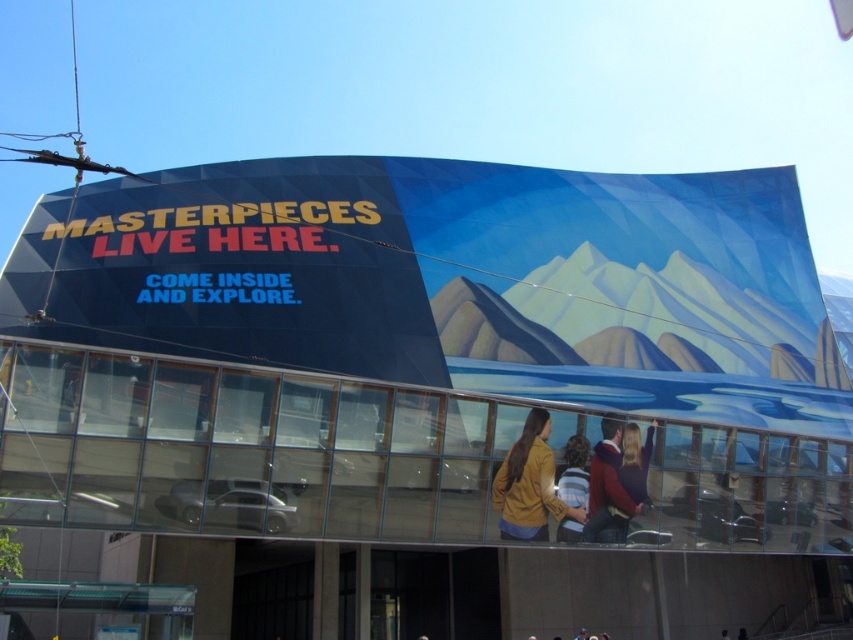
Does point (535, 465) come in front of point (599, 484)?

Yes, it is in front of point (599, 484).

Identify the location of matte yellow jacket at center. The image size is (853, 640). (529, 484).

Who is positioned more to the left, matte yellow jacket at center or striped sweater at center?

From the viewer's perspective, matte yellow jacket at center appears more on the left side.

Can you confirm if matte yellow jacket at center is positioned to the left of striped sweater at center?

Indeed, matte yellow jacket at center is positioned on the left side of striped sweater at center.

Where is `matte yellow jacket at center`? matte yellow jacket at center is located at coordinates (529, 484).

I want to click on matte yellow jacket at center, so click(x=529, y=484).

Between point (622, 515) and point (576, 524), which one is positioned in front?

Positioned in front is point (576, 524).

Can you confirm if maroon sweater at center is taller than striped sweater at center?

No, maroon sweater at center is not taller than striped sweater at center.

Image resolution: width=853 pixels, height=640 pixels. I want to click on maroon sweater at center, so click(x=608, y=486).